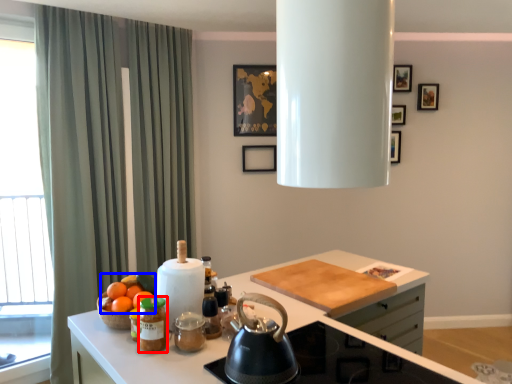
Question: Which object is further to the camera taking this photo, beverage (highlighted by a red box) or fruit (highlighted by a blue box)?

Choices:
 (A) beverage
 (B) fruit

Answer: (B)